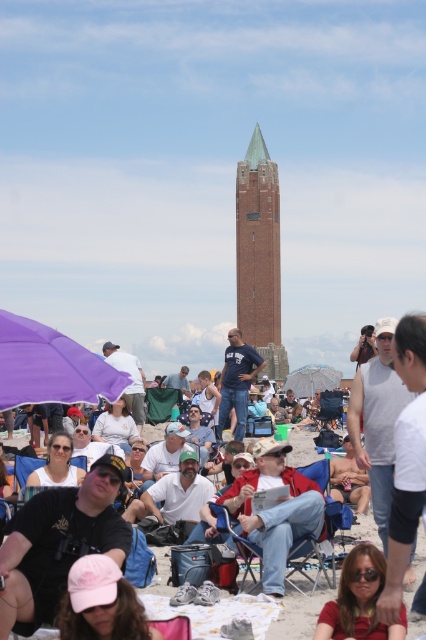
Who is taller, brick tower at center or purple matte umbrella at lower left?

With more height is brick tower at center.

Image resolution: width=426 pixels, height=640 pixels. Describe the element at coordinates (259, 256) in the screenshot. I see `brick tower at center` at that location.

Locate an element on the screen. brick tower at center is located at coordinates (259, 256).

Does brick tower at center have a lesser width compared to matte pink cap at lower center?

Correct, brick tower at center's width is less than matte pink cap at lower center's.

Where is `brick tower at center`? Image resolution: width=426 pixels, height=640 pixels. brick tower at center is located at coordinates pos(259,256).

Does brick tower at center lie behind printed fabric umbrella at center?

No.

Is point (270, 188) positioned in front of point (339, 384)?

That is True.

The width and height of the screenshot is (426, 640). What do you see at coordinates (259, 256) in the screenshot?
I see `brick tower at center` at bounding box center [259, 256].

Image resolution: width=426 pixels, height=640 pixels. What are the coordinates of `brick tower at center` in the screenshot? It's located at (259, 256).